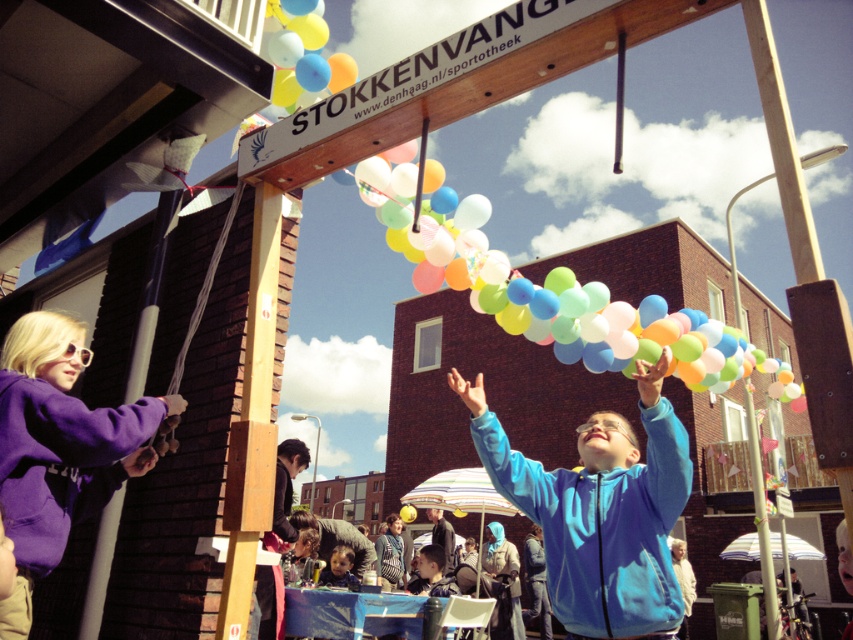
You are standing in front of the wooden archway at the event. There is a blue matte jacket at center and a matte blue hoodie at center. Which item is closer to you?

The blue matte jacket at center is closer to the viewer than the matte blue hoodie at center.